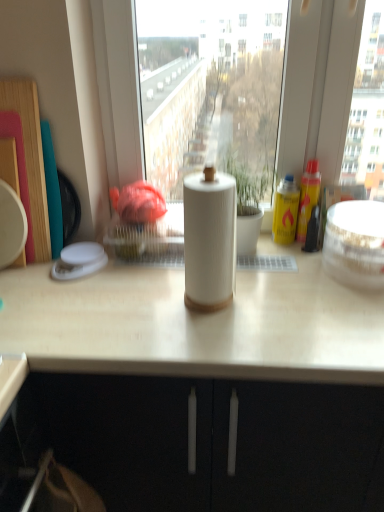
What do you see at coordinates (208, 385) in the screenshot? The height and width of the screenshot is (512, 384). I see `white matte paper towel holder at center` at bounding box center [208, 385].

Describe the element at coordinates (209, 239) in the screenshot. The image size is (384, 512). I see `white matte paper towel at center` at that location.

Find the location of a particular element. The image size is (384, 512). white glossy bowl at right, which is the 2th appliance from left to right is located at coordinates (355, 243).

From a real-world perspective, between white matte paper towel at center and white plastic container at left, the 2th appliance in the right-to-left sequence, who is vertically lower?

white plastic container at left, the 2th appliance in the right-to-left sequence, is physically lower.

Consider the image. Who is smaller, white matte paper towel at center or white plastic container at left, the 2th appliance in the right-to-left sequence?

white plastic container at left, the 2th appliance in the right-to-left sequence.

I want to click on the 2nd appliance directly beneath the white matte paper towel at center (from a real-world perspective), so click(79, 261).

Between point (223, 294) and point (66, 270), which one is positioned behind?

The point (66, 270) is behind.

Can you tell me how much white glossy bowl at right, which is the 2th appliance from left to right, and white matte paper towel at center differ in facing direction?

white glossy bowl at right, which is the 2th appliance from left to right, and white matte paper towel at center are facing 0.00504 degrees away from each other.

Considering the sizes of objects white glossy bowl at right, which is the 2th appliance from left to right, and white matte paper towel at center in the image provided, who is thinner, white glossy bowl at right, which is the 2th appliance from left to right, or white matte paper towel at center?

white matte paper towel at center.

Is white glossy bowl at right, which is the 2th appliance from left to right, further to camera compared to white matte paper towel at center?

Yes, it is.

In the scene shown: Is white glossy bowl at right, which is the 2th appliance from left to right, turned away from white matte paper towel at center?

No.

Does white glossy bowl at right, placed as the 1th appliance when sorted from right to left, have a lesser height compared to white plastic container at left, the 2th appliance in the right-to-left sequence?

Incorrect, the height of white glossy bowl at right, placed as the 1th appliance when sorted from right to left, does not fall short of that of white plastic container at left, the 2th appliance in the right-to-left sequence.

Is white glossy bowl at right, placed as the 1th appliance when sorted from right to left, facing away from white plastic container at left, the first appliance viewed from the left?

white glossy bowl at right, placed as the 1th appliance when sorted from right to left, does not have its back to white plastic container at left, the first appliance viewed from the left.

Find the location of a particular element. Image resolution: width=384 pixels, height=512 pixels. appliance on the right of white plastic container at left, the first appliance viewed from the left is located at coordinates (355, 243).

Is point (67, 256) less distant than point (333, 248)?

No, (67, 256) is behind (333, 248).

Does white plastic container at left, the 2th appliance in the right-to-left sequence, turn towards white glossy bowl at right, placed as the 1th appliance when sorted from right to left?

No, white plastic container at left, the 2th appliance in the right-to-left sequence, is not oriented towards white glossy bowl at right, placed as the 1th appliance when sorted from right to left.

Who is shorter, white plastic container at left, the first appliance viewed from the left, or white glossy bowl at right, placed as the 1th appliance when sorted from right to left?

white plastic container at left, the first appliance viewed from the left, is shorter.

Does point (81, 451) lie behind point (184, 193)?

Yes, it is behind point (184, 193).

Is white matte paper towel holder at center facing towards white matte paper towel at center?

No, white matte paper towel holder at center is not turned towards white matte paper towel at center.

How many degrees apart are the facing directions of white matte paper towel holder at center and white matte paper towel at center?

white matte paper towel holder at center and white matte paper towel at center are facing 1.58 degrees away from each other.

Is white matte paper towel holder at center to the right of white matte paper towel at center from the viewer's perspective?

Incorrect, white matte paper towel holder at center is not on the right side of white matte paper towel at center.

Could you tell me if white plastic container at left, the 2th appliance in the right-to-left sequence, is facing white matte paper towel holder at center?

No, white plastic container at left, the 2th appliance in the right-to-left sequence, is not turned towards white matte paper towel holder at center.

Which of these two, white plastic container at left, the 2th appliance in the right-to-left sequence, or white matte paper towel holder at center, is thinner?

Thinner between the two is white plastic container at left, the 2th appliance in the right-to-left sequence.

Does point (84, 269) appear closer or farther from the camera than point (331, 360)?

Point (84, 269) appears to be farther away from the viewer than point (331, 360).

In the image, there is a white plastic container at left, the first appliance viewed from the left. Where is `countertop below it (from the image's perspective)`? countertop below it (from the image's perspective) is located at coordinates (208, 385).

Would you say white glossy bowl at right, which is the 2th appliance from left to right, is part of white matte paper towel holder at center's contents?

That's incorrect, white glossy bowl at right, which is the 2th appliance from left to right, is not inside white matte paper towel holder at center.

Which is more to the right, white matte paper towel holder at center or white glossy bowl at right, which is the 2th appliance from left to right?

white glossy bowl at right, which is the 2th appliance from left to right, is more to the right.

From the image's perspective, is white matte paper towel holder at center positioned above or below white glossy bowl at right, which is the 2th appliance from left to right?

From the image's perspective, white matte paper towel holder at center appears below white glossy bowl at right, which is the 2th appliance from left to right.

Is white matte paper towel holder at center wider than white glossy bowl at right, placed as the 1th appliance when sorted from right to left?

Correct, the width of white matte paper towel holder at center exceeds that of white glossy bowl at right, placed as the 1th appliance when sorted from right to left.

The image size is (384, 512). I want to click on the 2nd appliance located beneath the white matte paper towel at center (from a real-world perspective), so click(79, 261).

The width and height of the screenshot is (384, 512). Identify the location of paper towel on the left of white glossy bowl at right, which is the 2th appliance from left to right. (209, 239).

Considering their positions, is white matte paper towel holder at center positioned further to white glossy bowl at right, placed as the 1th appliance when sorted from right to left, than white matte paper towel at center?

white matte paper towel holder at center is further to white glossy bowl at right, placed as the 1th appliance when sorted from right to left.

Based on their spatial positions, is white glossy bowl at right, placed as the 1th appliance when sorted from right to left, or white matte paper towel holder at center further from white matte paper towel at center?

white glossy bowl at right, placed as the 1th appliance when sorted from right to left, is further to white matte paper towel at center.

Which object lies nearer to the anchor point white matte paper towel at center, white plastic container at left, the 2th appliance in the right-to-left sequence, or white glossy bowl at right, placed as the 1th appliance when sorted from right to left?

Based on the image, white glossy bowl at right, placed as the 1th appliance when sorted from right to left, appears to be nearer to white matte paper towel at center.

Looking at the image, which one is located further to white plastic container at left, the first appliance viewed from the left, white glossy bowl at right, which is the 2th appliance from left to right, or white matte paper towel at center?

white glossy bowl at right, which is the 2th appliance from left to right, is positioned further to the anchor white plastic container at left, the first appliance viewed from the left.

Estimate the real-world distances between objects in this image. Which object is closer to white matte paper towel holder at center, white glossy bowl at right, placed as the 1th appliance when sorted from right to left, or white plastic container at left, the first appliance viewed from the left?

Among the two, white glossy bowl at right, placed as the 1th appliance when sorted from right to left, is located nearer to white matte paper towel holder at center.

When comparing their distances from white matte paper towel at center, does white glossy bowl at right, which is the 2th appliance from left to right, or white plastic container at left, the 2th appliance in the right-to-left sequence, seem closer?

white glossy bowl at right, which is the 2th appliance from left to right, is closer to white matte paper towel at center.

When comparing their distances from white plastic container at left, the 2th appliance in the right-to-left sequence, does white matte paper towel at center or white glossy bowl at right, which is the 2th appliance from left to right, seem further?

white glossy bowl at right, which is the 2th appliance from left to right, is positioned further to the anchor white plastic container at left, the 2th appliance in the right-to-left sequence.

Estimate the real-world distances between objects in this image. Which object is further from white plastic container at left, the 2th appliance in the right-to-left sequence, white matte paper towel holder at center or white matte paper towel at center?

white matte paper towel holder at center.

The width and height of the screenshot is (384, 512). In order to click on countertop between white plastic container at left, the first appliance viewed from the left, and white glossy bowl at right, which is the 2th appliance from left to right, in the horizontal direction in this screenshot , I will do `click(208, 385)`.

Where is `paper towel located between white plastic container at left, the 2th appliance in the right-to-left sequence, and white glossy bowl at right, placed as the 1th appliance when sorted from right to left, in the left-right direction`? Image resolution: width=384 pixels, height=512 pixels. paper towel located between white plastic container at left, the 2th appliance in the right-to-left sequence, and white glossy bowl at right, placed as the 1th appliance when sorted from right to left, in the left-right direction is located at coordinates (209, 239).

I want to click on paper towel that lies between white glossy bowl at right, placed as the 1th appliance when sorted from right to left, and white matte paper towel holder at center from top to bottom, so click(x=209, y=239).

In order to click on appliance between white matte paper towel at center and white matte paper towel holder at center in the vertical direction in this screenshot , I will do `click(79, 261)`.